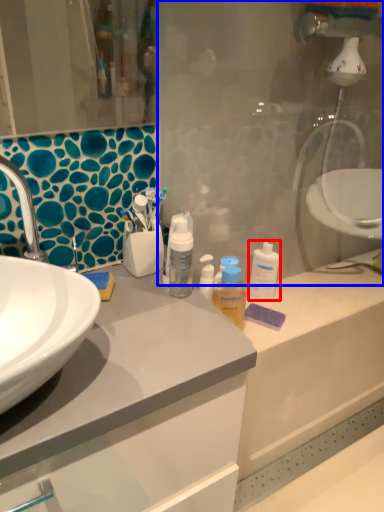
Question: Which of the following is the closest to the observer, cleaning product (highlighted by a red box) or glass door (highlighted by a blue box)?

Choices:
 (A) cleaning product
 (B) glass door

Answer: (B)